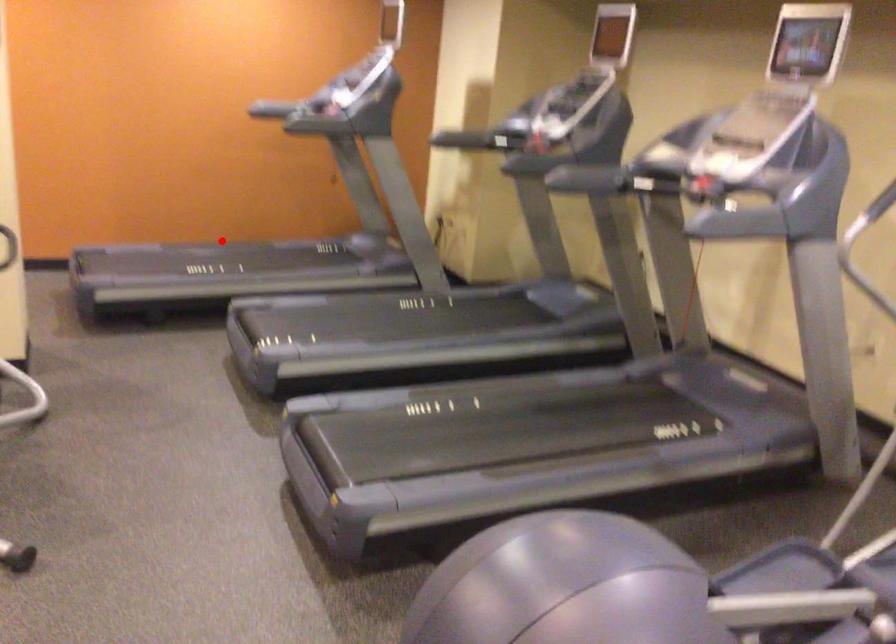
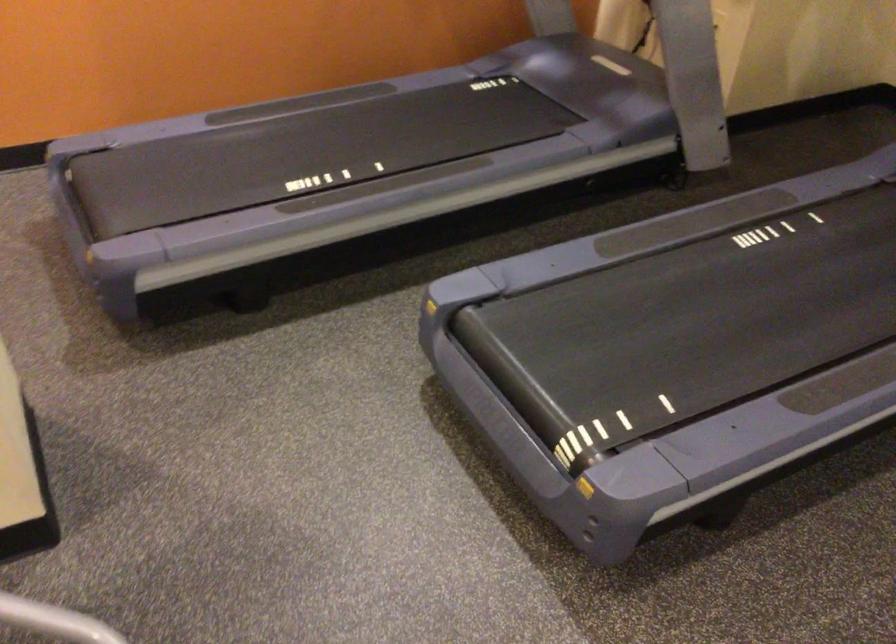
Find the pixel in the second image that matches the highlighted location in the first image.

(294, 104)